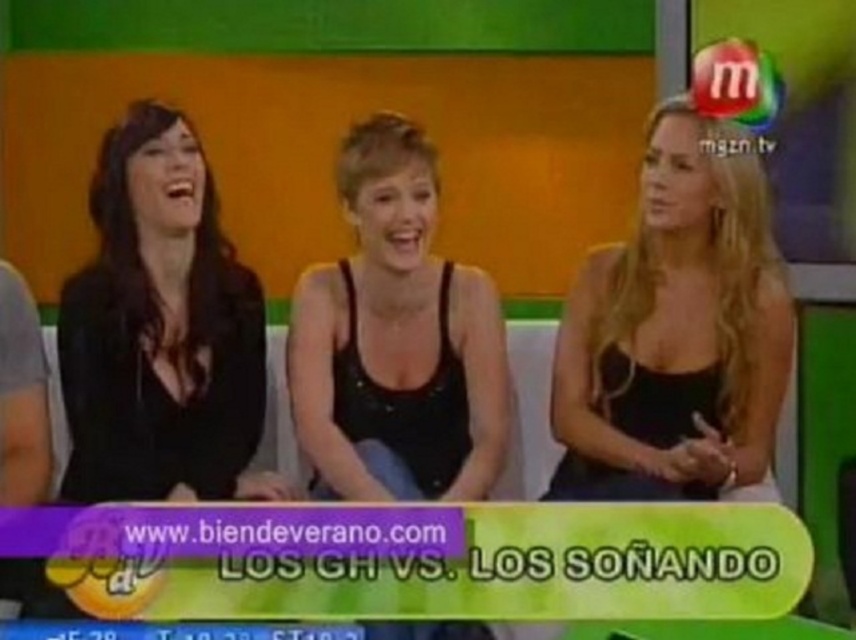
You are a costume designer preparing for a photoshoot. You have two items of clothing to choose from for the main character. The items are the black matte dress at center and the black matte tank top at center. Based on the scene description, which clothing item takes up more space visually on the character?

The black matte dress at center has a larger width than the black matte tank top at center, so the dress takes up more visual space on the character.

You are a costume designer working on a new TV show. You need to place a black matte dress at left in the studio scene. Where should you position it based on the coordinates provided?

The black matte dress at left should be positioned at the 2D coordinates point (159, 330) in the studio scene.